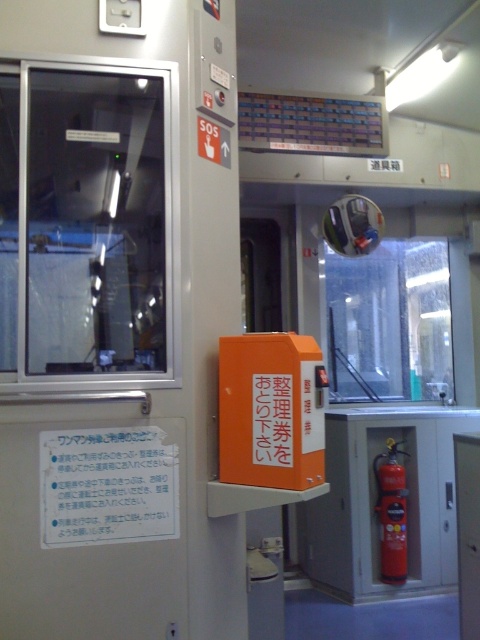
You are standing in the train car and want to exit through the door. The transparent glass door at upper left is the nearest exit. Your backpack is 2 meters long. Can you carry your backpack through the door without tilting it?

The transparent glass door at upper left is 1.91 meters from viewer. Since your backpack is 2 meters long, it is slightly longer than the distance to the door. You may need to tilt or adjust your backpack to fit through the door.

You are a passenger standing in the train car and want to exit through the door. Which object, the transparent glass door at upper left or the red matte fire extinguisher at right, is positioned higher?

The transparent glass door at upper left is positioned higher than the red matte fire extinguisher at right according to the description.